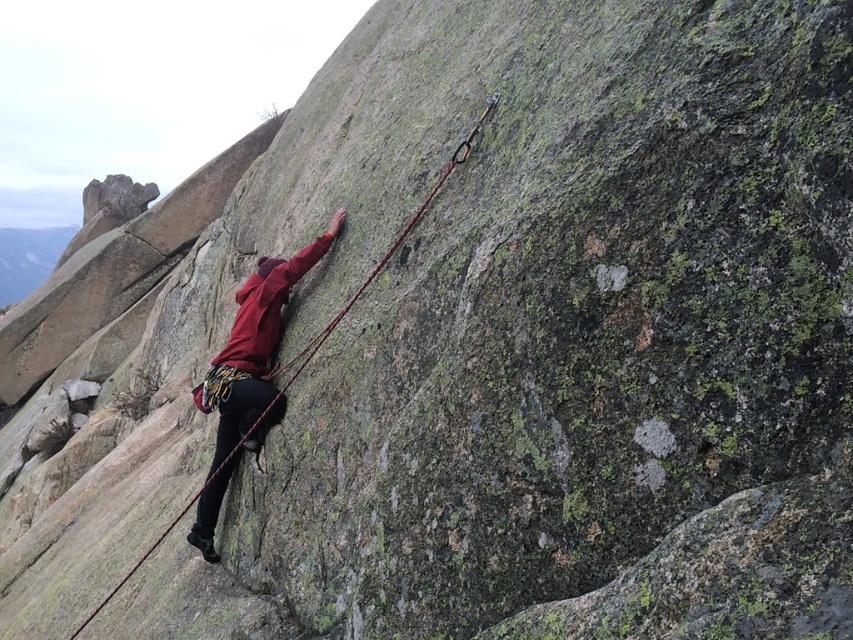
You are a rock climbing instructor observing a climber. You notice the climber has a matte red jacket at center and a red nylon rope at center. Based on their positions, which item is higher up on the rock face?

→ The matte red jacket at center is above the red nylon rope at center, so the matte red jacket at center is higher up on the rock face.

You are a safety inspector evaluating the rock climber in the image. The climber is wearing a matte red jacket at center and using a red nylon rope at center. According to safety protocols, the rope should be positioned higher than the climber to ensure proper anchoring. Does the current setup meet safety standards?

The matte red jacket at center has a lesser height compared to red nylon rope at center, meaning the rope is positioned higher than the climber. This setup meets safety standards as the rope is correctly placed above the climber for proper anchoring.

You are a safety inspector evaluating the rock climbing setup. The standard requires that the climber must have a safety rope that is wider than their jacket to ensure visibility. Given the image, does the red nylon rope at center meet this requirement compared to the matte red jacket at center?

The matte red jacket at center has a width less than the red nylon rope at center, so the red nylon rope at center is wider and meets the visibility requirement.